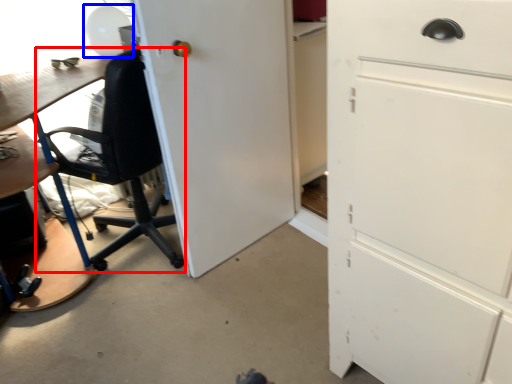
Question: Which point is further to the camera, chair (highlighted by a red box) or table lamp (highlighted by a blue box)?

Choices:
 (A) chair
 (B) table lamp

Answer: (B)